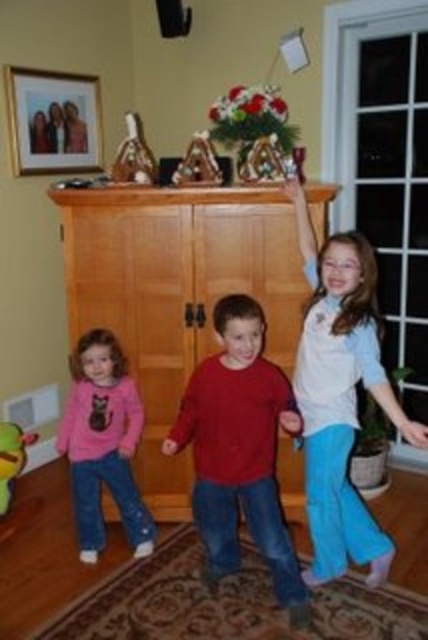
Is white cotton shirt at upper right to the right of shiny chocolate candy at center from the viewer's perspective?

Yes, white cotton shirt at upper right is to the right of shiny chocolate candy at center.

Does white cotton shirt at upper right have a lesser width compared to shiny chocolate candy at center?

In fact, white cotton shirt at upper right might be wider than shiny chocolate candy at center.

Describe the element at coordinates (339, 397) in the screenshot. I see `white cotton shirt at upper right` at that location.

Find the location of a particular element. This screenshot has width=428, height=640. white cotton shirt at upper right is located at coordinates (339, 397).

Does matte wooden picture frame at upper left appear under shiny chocolate candy at center?

Incorrect, matte wooden picture frame at upper left is not positioned below shiny chocolate candy at center.

Is matte wooden picture frame at upper left above shiny chocolate candy at center?

Yes.

Is point (29, 129) less distant than point (130, 122)?

No, (29, 129) is behind (130, 122).

Locate an element on the screen. This screenshot has width=428, height=640. matte wooden picture frame at upper left is located at coordinates (53, 122).

Between matte wooden picture frame at upper left and metallic triangular ornament at center, which one appears on the left side from the viewer's perspective?

From the viewer's perspective, matte wooden picture frame at upper left appears more on the left side.

Is matte wooden picture frame at upper left below metallic triangular ornament at center?

No.

This screenshot has width=428, height=640. Describe the element at coordinates (53, 122) in the screenshot. I see `matte wooden picture frame at upper left` at that location.

Locate an element on the screen. Image resolution: width=428 pixels, height=640 pixels. matte wooden picture frame at upper left is located at coordinates (53, 122).